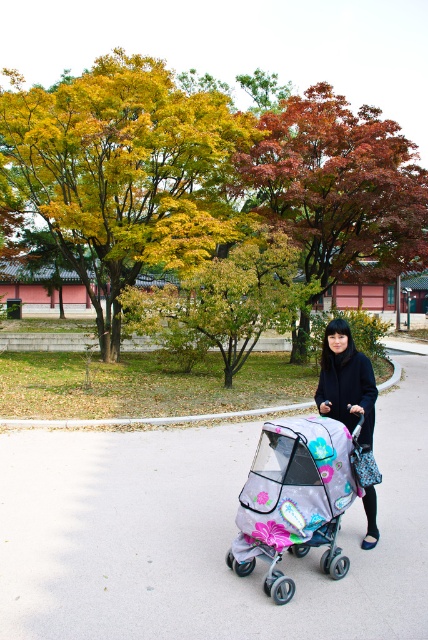
What do you see at coordinates (199, 536) in the screenshot? I see `gray asphalt pavement at center` at bounding box center [199, 536].

The height and width of the screenshot is (640, 428). I want to click on gray asphalt pavement at center, so click(199, 536).

Is point (2, 600) positioned after point (333, 376)?

No, (2, 600) is closer to viewer.

In order to click on gray asphalt pavement at center in this screenshot , I will do `click(199, 536)`.

Consider the image. Does autumn leaves at upper center come behind black matte coat at center?

That is True.

Is point (416, 259) positioned after point (341, 346)?

Yes, point (416, 259) is behind point (341, 346).

Locate an element on the screen. The width and height of the screenshot is (428, 640). autumn leaves at upper center is located at coordinates (207, 177).

Can you confirm if floral-patterned fabric stroller at center is shorter than black matte coat at center?

Incorrect, floral-patterned fabric stroller at center's height does not fall short of black matte coat at center's.

Is floral-patterned fabric stroller at center positioned behind black matte coat at center?

No, floral-patterned fabric stroller at center is closer to the viewer.

The width and height of the screenshot is (428, 640). Find the location of `floral-patterned fabric stroller at center`. floral-patterned fabric stroller at center is located at coordinates (294, 499).